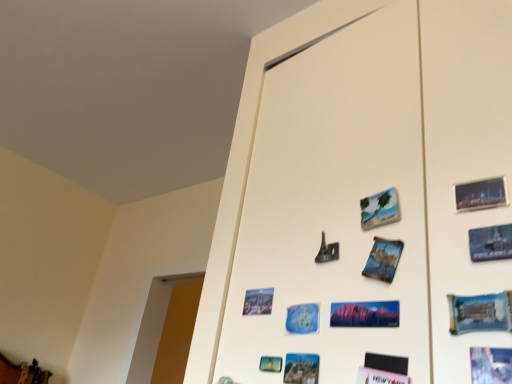
Question: From the image's perspective, is beige matte postcard at upper center, which is the third postcard in right-to-left order, located above or below matte paper postcard at lower center, arranged as the 1th postcard when viewed from the left?

Choices:
 (A) below
 (B) above

Answer: (B)

Question: Is beige matte postcard at upper center, arranged as the sixth postcard when viewed from the left, inside the boundaries of matte paper postcard at lower center, positioned as the eighth postcard in right-to-left order, or outside?

Choices:
 (A) inside
 (B) outside

Answer: (B)

Question: Based on their relative distances, which object is nearer to the blue paper postcard at lower center, which appears as the second postcard when viewed from the left?

Choices:
 (A) blue glossy postcard at lower right, the second postcard positioned from the right
 (B) metallic gold jewelry at lower left
 (C) matte red rock formation at center, the fourth postcard in the left-to-right sequence
 (D) blue paper postcard at lower right, the 8th postcard from the left
 (E) metallic silver eiffel tower at center

Answer: (C)

Question: Considering the real-world distances, which object is closest to the beige matte postcard at upper center, which is the third postcard in right-to-left order?

Choices:
 (A) matte paper postcard at lower center, arranged as the 1th postcard when viewed from the left
 (B) metallic silver eiffel tower at center
 (C) blue paper postcard at center, the fifth postcard positioned from the left
 (D) matte red rock formation at center, the 5th postcard when ordered from right to left
 (E) blue paper postcard at lower center, which appears as the second postcard when viewed from the left

Answer: (C)